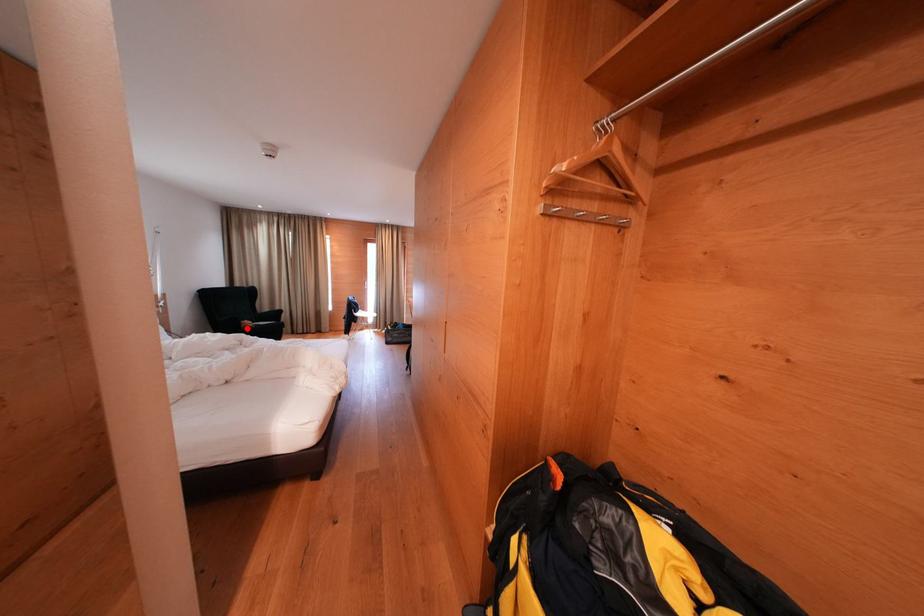
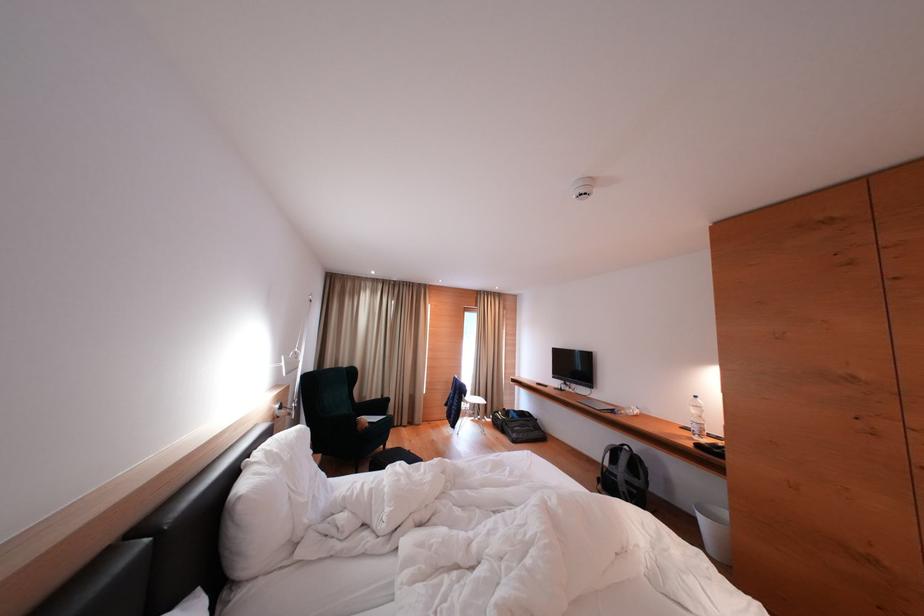
Locate, in the second image, the point that corresponds to the highlighted location in the first image.

(362, 428)